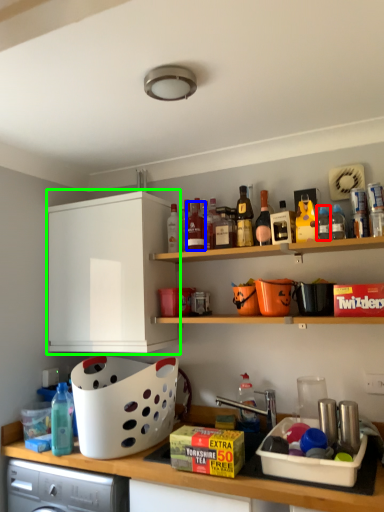
Question: Based on their relative distances, which object is farther from bottle (highlighted by a red box)? Choose from bottle (highlighted by a blue box) and cabinetry (highlighted by a green box).

Choices:
 (A) bottle
 (B) cabinetry

Answer: (B)